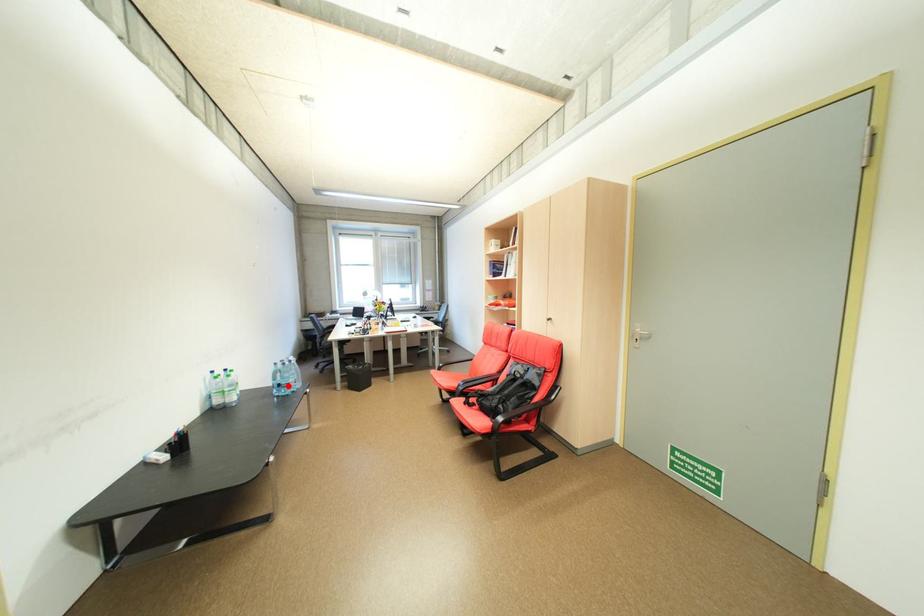
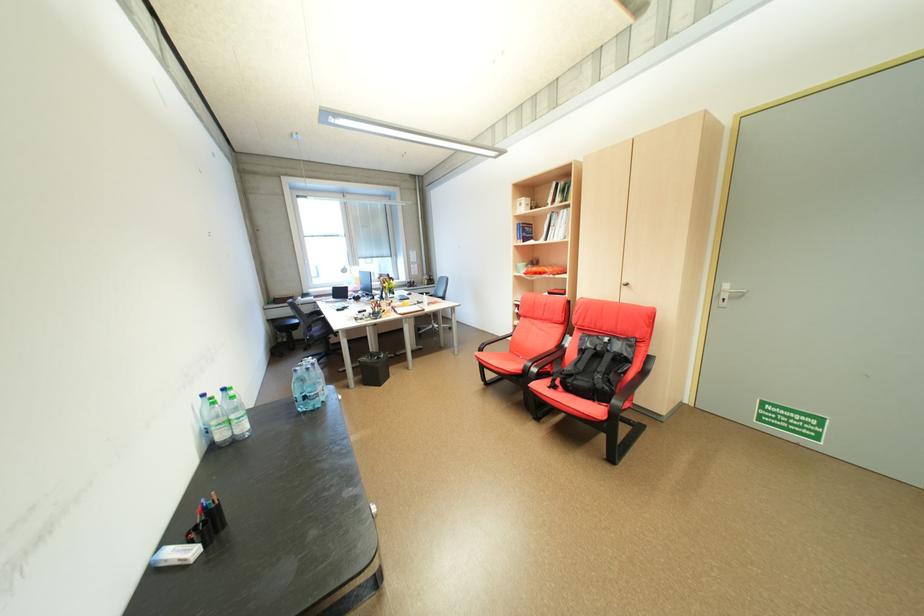
Question: I am providing you with two images of the same scene from different viewpoints. Image1 has a red point marked. In image2, the corresponding 3D location appears at what relative position? Reply with the corresponding letter.

Choices:
 (A) Closer
 (B) Farther

Answer: (B)